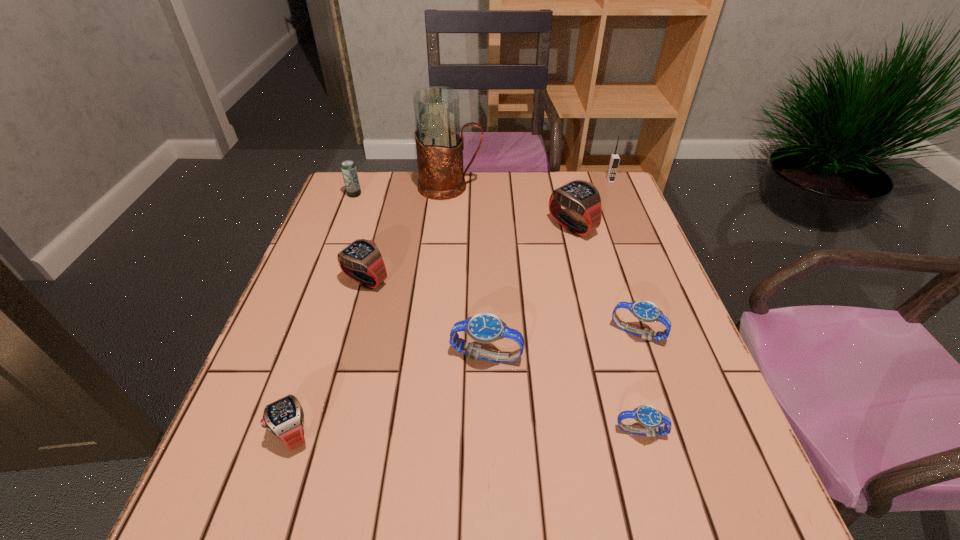
I want to click on cellular telephone present at the far right corner, so click(614, 159).

The height and width of the screenshot is (540, 960). Identify the location of watch located in the far right corner section of the desktop. [x=579, y=196].

Image resolution: width=960 pixels, height=540 pixels. What are the coordinates of `vacant space at the far edge of the desktop` in the screenshot? It's located at (418, 177).

I want to click on vacant region at the near edge of the desktop, so click(414, 520).

In the image, there is a desktop. Where is `vacant region at the left edge`? Image resolution: width=960 pixels, height=540 pixels. vacant region at the left edge is located at coordinates (311, 378).

The height and width of the screenshot is (540, 960). In order to click on free space at the right edge of the desktop in this screenshot , I will do `click(621, 228)`.

The height and width of the screenshot is (540, 960). In the image, there is a desktop. Find the location of `vacant space at the far right corner`. vacant space at the far right corner is located at coordinates (591, 176).

You are a GUI agent. You are given a task and a screenshot of the screen. Output one action in this format:
    pyautogui.click(x=<x>, y=<y>)
    Task: Click on the free space at the near right corner of the desktop
    Image resolution: width=960 pixels, height=540 pixels.
    Given the screenshot: What is the action you would take?
    pyautogui.click(x=738, y=531)

This screenshot has width=960, height=540. Find the location of `vacant space in between the rightmost object and the nearest red watch`. vacant space in between the rightmost object and the nearest red watch is located at coordinates (452, 307).

Locate an element on the screen. The width and height of the screenshot is (960, 540). vacant area that lies between the leftmost blue watch and the beer can is located at coordinates (420, 275).